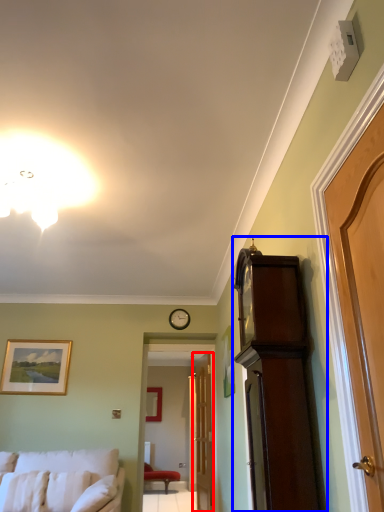
Question: Which object appears farthest to the camera in this image, door (highlighted by a red box) or cabinetry (highlighted by a blue box)?

Choices:
 (A) door
 (B) cabinetry

Answer: (A)